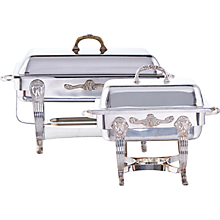
The height and width of the screenshot is (220, 220). What are the coordinates of `small silver chafing dish` in the screenshot? It's located at (115, 91).